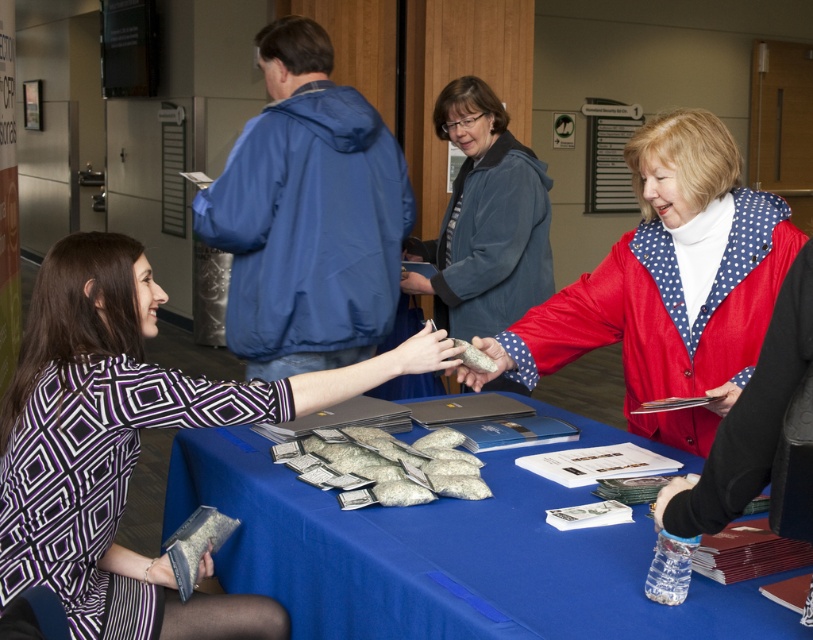
You are standing in the conference room and want to determine which of the two points, point (68, 492) or point (427, 364), is closer to you. Based on the scene description, which point is nearer?

Point (68, 492) is closer to the viewer than point (427, 364).

You are standing at the entrance of the conference room and want to locate the person wearing the polka dot fabric jacket at center. According to the coordinates provided, where should you look to find them?

The person wearing the polka dot fabric jacket at center is located at coordinates point (670,284).